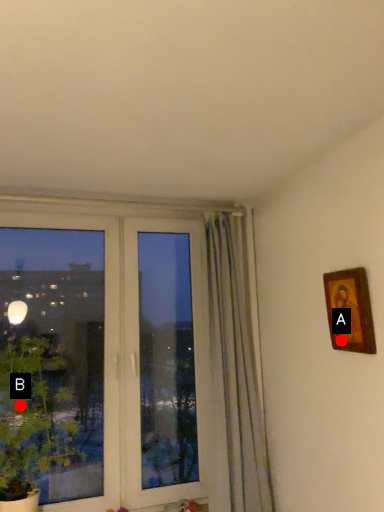
Question: Two points are circled on the image, labeled by A and B beside each circle. Which point is closer to the camera?

Choices:
 (A) A is closer
 (B) B is closer

Answer: (A)